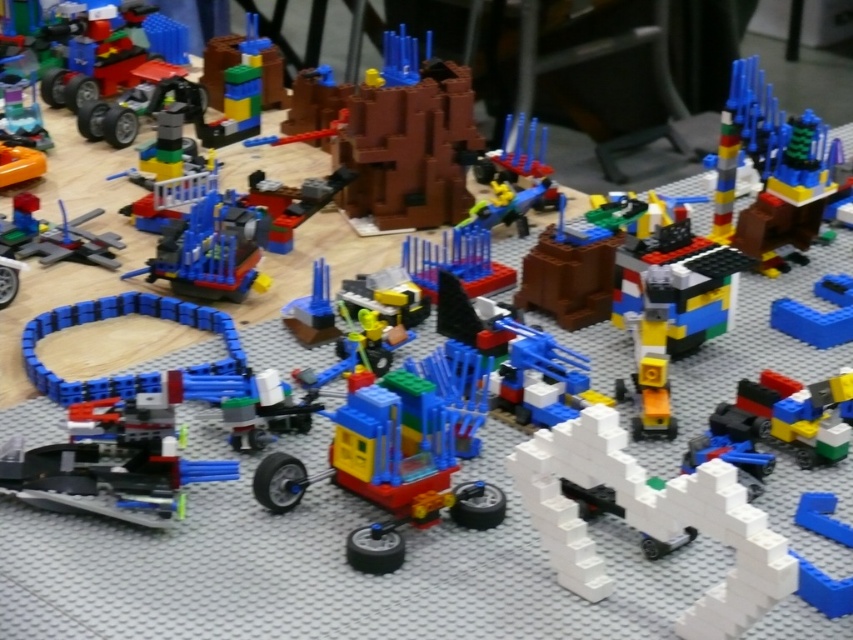
The image size is (853, 640). What do you see at coordinates (650, 520) in the screenshot? I see `white matte brick wall at lower right` at bounding box center [650, 520].

Which is in front, point (604, 460) or point (776, 116)?

Point (604, 460) is in front.

You are a GUI agent. You are given a task and a screenshot of the screen. Output one action in this format:
    pyautogui.click(x=<x>, y=<y>)
    Task: Click on the white matte brick wall at lower right
    The width and height of the screenshot is (853, 640).
    Given the screenshot: What is the action you would take?
    pyautogui.click(x=650, y=520)

Is translucent yellow car at center to the right of translucent blue plastic tower at upper right from the viewer's perspective?

Incorrect, translucent yellow car at center is not on the right side of translucent blue plastic tower at upper right.

Is point (277, 464) farther from viewer compared to point (759, 266)?

No.

Is point (405, 442) in front of point (738, 237)?

Yes, it is in front of point (738, 237).

You are a GUI agent. You are given a task and a screenshot of the screen. Output one action in this format:
    pyautogui.click(x=<x>, y=<y>)
    Task: Click on the translucent yellow car at center
    The width and height of the screenshot is (853, 640).
    Given the screenshot: What is the action you would take?
    pyautogui.click(x=402, y=467)

What do you see at coordinates (770, 170) in the screenshot? I see `translucent blue plastic tower at upper right` at bounding box center [770, 170].

What are the coordinates of `translucent blue plastic tower at upper right` in the screenshot? It's located at (770, 170).